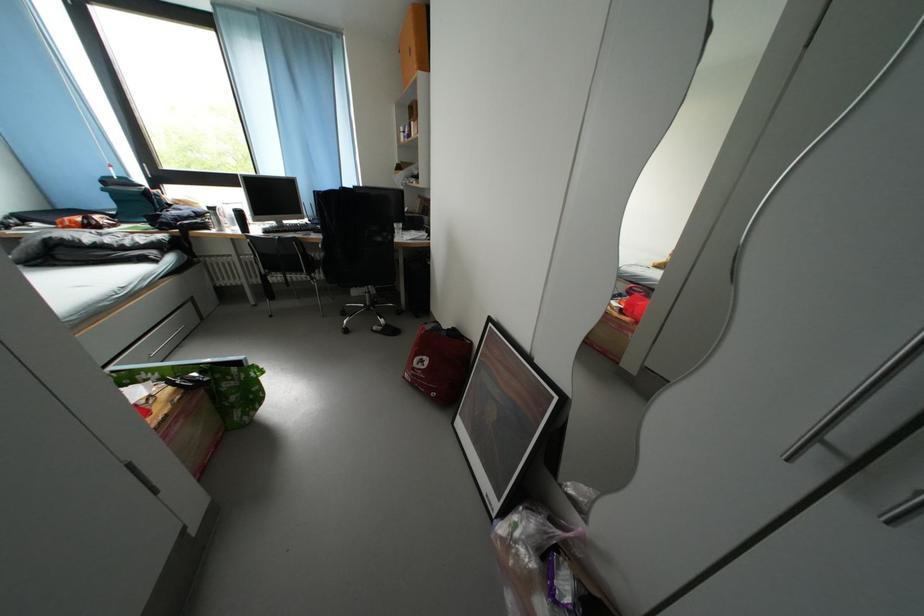
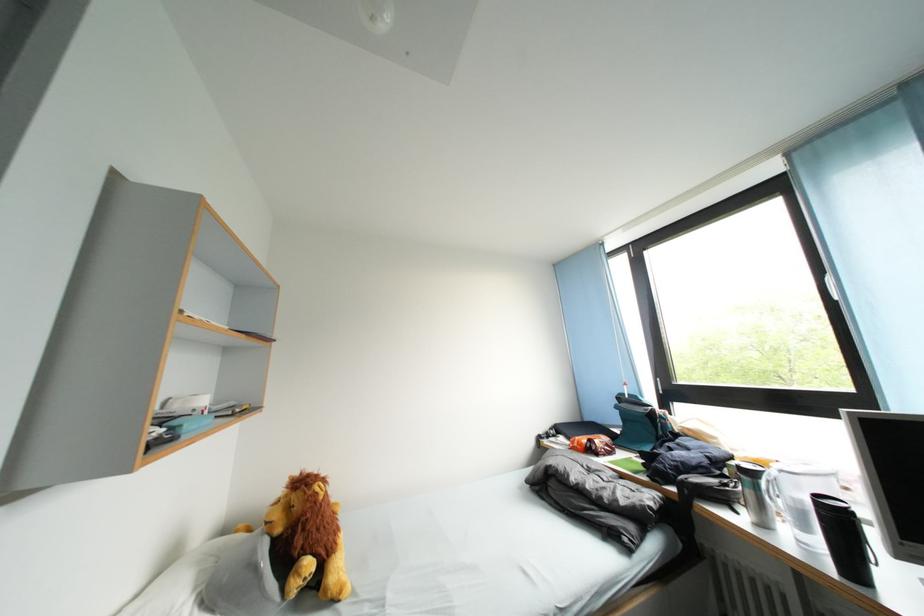
Question: I am providing you with two images of the same scene from different viewpoints. Please identify which objects are invisible in image2.

Choices:
 (A) silver travel mug
 (B) blind pull cord
 (C) stuffed lion toy
 (D) none of these

Answer: (D)